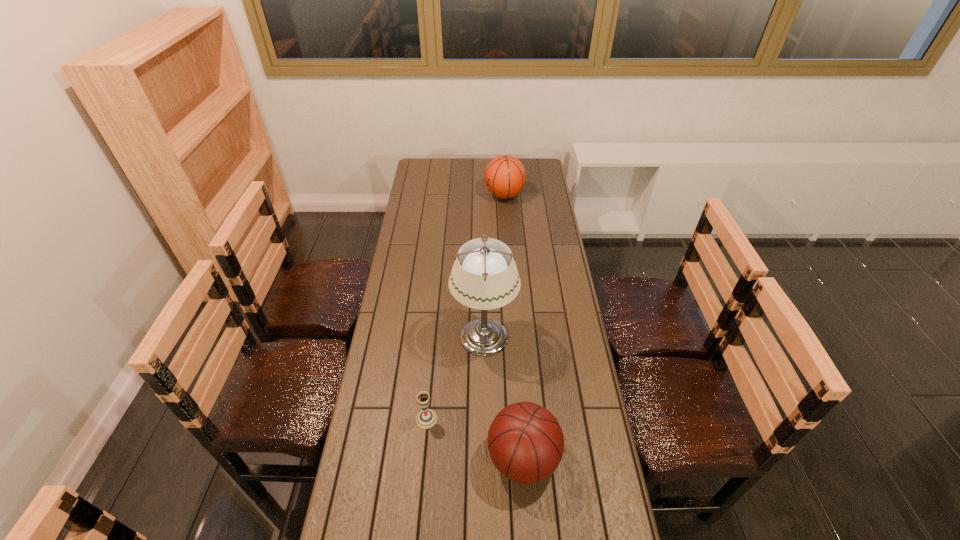
You are a GUI agent. You are given a task and a screenshot of the screen. Output one action in this format:
    pyautogui.click(x=<x>, y=<y>)
    Task: Click on the free spot between the farthest object and the chalice
    The height and width of the screenshot is (540, 960).
    Given the screenshot: What is the action you would take?
    pyautogui.click(x=466, y=307)

What are the coordinates of `free space between the farthest object and the shortest object` in the screenshot? It's located at (466, 307).

Find the location of a particular element. The image size is (960, 540). vacant space that is in between the farther basketball and the chalice is located at coordinates (466, 307).

This screenshot has height=540, width=960. What are the coordinates of `empty space between the leftmost object and the nearer basketball` in the screenshot? It's located at (475, 438).

The image size is (960, 540). What are the coordinates of `vacant space that is in between the nearer basketball and the farthest object` in the screenshot? It's located at (514, 327).

Where is `object that stands as the second closest to the lampshade`? object that stands as the second closest to the lampshade is located at coordinates (525, 441).

Identify which object is the closest to the farthest object. Please provide its 2D coordinates. Your answer should be formatted as a tuple, i.e. [(x, y)], where the tuple contains the x and y coordinates of a point satisfying the conditions above.

[(484, 281)]

Where is `free location that satisfies the following two spatial constraints: 1. on the back side of the nearer basketball; 2. on the lampshade of the tallest object`? The width and height of the screenshot is (960, 540). free location that satisfies the following two spatial constraints: 1. on the back side of the nearer basketball; 2. on the lampshade of the tallest object is located at coordinates (515, 336).

You are a GUI agent. You are given a task and a screenshot of the screen. Output one action in this format:
    pyautogui.click(x=<x>, y=<y>)
    Task: Click on the blank space that satisfies the following two spatial constraints: 1. on the lampshade of the tallest object; 2. on the front side of the leftmost object
    Image resolution: width=960 pixels, height=540 pixels.
    Given the screenshot: What is the action you would take?
    pyautogui.click(x=485, y=418)

You are a GUI agent. You are given a task and a screenshot of the screen. Output one action in this format:
    pyautogui.click(x=<x>, y=<y>)
    Task: Click on the vacant position in the image that satisfies the following two spatial constraints: 1. on the back side of the farthest object; 2. on the left side of the nearer basketball
    The width and height of the screenshot is (960, 540).
    Given the screenshot: What is the action you would take?
    pyautogui.click(x=504, y=195)